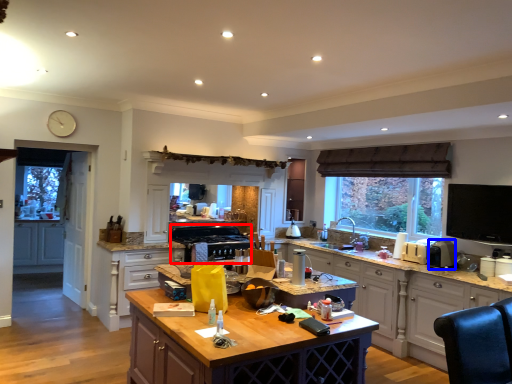
Question: Which of the following is the closest to the observer, appliance (highlighted by a red box) or appliance (highlighted by a blue box)?

Choices:
 (A) appliance
 (B) appliance

Answer: (B)